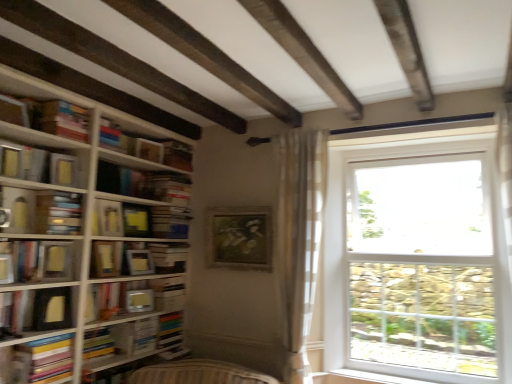
Describe the element at coordinates (298, 239) in the screenshot. The image size is (512, 384). I see `white sheer curtain at center` at that location.

You are a GUI agent. You are given a task and a screenshot of the screen. Output one action in this format:
    pyautogui.click(x=<x>, y=<y>)
    Task: Click on the white sheer curtain at center
    The image size is (512, 384).
    Given the screenshot: What is the action you would take?
    298,239

What do you see at coordinates (144, 183) in the screenshot? I see `hardcover book at center-left, acting as the 2th book starting from the top` at bounding box center [144, 183].

Describe the element at coordinates (240, 238) in the screenshot. I see `wooden picture frame at center` at that location.

What are the coordinates of `yellow matte paper at left, arranged as the fifth paperback book when ordered from the bottom` in the screenshot? It's located at (55, 261).

Describe the element at coordinates (42, 360) in the screenshot. This screenshot has height=384, width=512. I see `hardcover book at left, which ranks as the ninth paperback book in top-to-bottom order` at that location.

You are a GUI agent. You are given a task and a screenshot of the screen. Output one action in this format:
    pyautogui.click(x=<x>, y=<y>)
    Task: Click on the matte yellow paperback at center-left, which appears as the 6th paperback book when viewed from the top
    
    Given the screenshot: What is the action you would take?
    pyautogui.click(x=106, y=259)

This screenshot has height=384, width=512. What are the coordinates of `matte plastic frame at left, arranged as the 2th shelf when viewed from the front` in the screenshot? It's located at (135, 297).

Which is more to the right, matte black book at upper center, which is the 1th paperback book from top to bottom, or white plastic window sill at lower right?

From the viewer's perspective, white plastic window sill at lower right appears more on the right side.

From the image's perspective, who appears lower, matte black book at upper center, acting as the ninth paperback book starting from the bottom, or white plastic window sill at lower right?

From the image's view, white plastic window sill at lower right is below.

From a real-world perspective, is matte black book at upper center, acting as the ninth paperback book starting from the bottom, physically located above or below white plastic window sill at lower right?

matte black book at upper center, acting as the ninth paperback book starting from the bottom, is above white plastic window sill at lower right.

How many degrees apart are the facing directions of matte black book at upper center, which is the 1th paperback book from top to bottom, and white plastic window sill at lower right?

matte black book at upper center, which is the 1th paperback book from top to bottom, and white plastic window sill at lower right are facing 79.8 degrees away from each other.

Is wooden picture frame at center thinner than white plastic window sill at lower right?

Yes, wooden picture frame at center is thinner than white plastic window sill at lower right.

Is white plastic window sill at lower right inside wooden picture frame at center?

That's incorrect, white plastic window sill at lower right is not inside wooden picture frame at center.

Can you confirm if wooden picture frame at center is shorter than white plastic window sill at lower right?

No, wooden picture frame at center is not shorter than white plastic window sill at lower right.

Locate an element on the screen. This screenshot has height=384, width=512. window sill in front of the wooden picture frame at center is located at coordinates (383, 378).

Would you consider matte black book at upper center, acting as the ninth paperback book starting from the bottom, to be distant from white matte paperback book at center, the second paperback book from the bottom?

matte black book at upper center, acting as the ninth paperback book starting from the bottom, is actually quite close to white matte paperback book at center, the second paperback book from the bottom.

Consider the image. Is matte black book at upper center, acting as the ninth paperback book starting from the bottom, looking in the opposite direction of white matte paperback book at center, the eighth paperback book positioned from the top?

matte black book at upper center, acting as the ninth paperback book starting from the bottom, is not turned away from white matte paperback book at center, the eighth paperback book positioned from the top.

How distant is matte black book at upper center, which is the 1th paperback book from top to bottom, from white matte paperback book at center, the second paperback book from the bottom?

89.43 centimeters.

Between matte black book at upper center, which is the 1th paperback book from top to bottom, and white matte paperback book at center, the eighth paperback book positioned from the top, which one is positioned in front?

matte black book at upper center, which is the 1th paperback book from top to bottom.

Is matte yellow paperback at center-left, which appears as the 6th paperback book when viewed from the top, taller or shorter than matte brown book at left, the 7th paperback book in the bottom-to-top sequence?

In the image, matte yellow paperback at center-left, which appears as the 6th paperback book when viewed from the top, appears to be taller than matte brown book at left, the 7th paperback book in the bottom-to-top sequence.

Looking at this image, considering the positions of objects matte yellow paperback at center-left, which appears as the 6th paperback book when viewed from the top, and matte brown book at left, arranged as the third paperback book when viewed from the top, in the image provided, who is more to the left, matte yellow paperback at center-left, which appears as the 6th paperback book when viewed from the top, or matte brown book at left, arranged as the third paperback book when viewed from the top,?

matte brown book at left, arranged as the third paperback book when viewed from the top, is more to the left.

Consider the image. Considering their positions, is matte yellow paperback at center-left, which appears as the 6th paperback book when viewed from the top, located in front of or behind matte brown book at left, the 7th paperback book in the bottom-to-top sequence?

matte yellow paperback at center-left, which appears as the 6th paperback book when viewed from the top, is positioned farther from the viewer than matte brown book at left, the 7th paperback book in the bottom-to-top sequence.

Considering the relative sizes of matte yellow paperback at center-left, marked as the fourth paperback book in a bottom-to-top arrangement, and matte brown book at left, arranged as the third paperback book when viewed from the top, in the image provided, is matte yellow paperback at center-left, marked as the fourth paperback book in a bottom-to-top arrangement, bigger than matte brown book at left, arranged as the third paperback book when viewed from the top,?

Actually, matte yellow paperback at center-left, marked as the fourth paperback book in a bottom-to-top arrangement, might be smaller than matte brown book at left, arranged as the third paperback book when viewed from the top.

Does hardcover book at left, which ranks as the ninth paperback book in top-to-bottom order, turn towards matte plastic frame at left, arranged as the first shelf when viewed from the back?

No, hardcover book at left, which ranks as the ninth paperback book in top-to-bottom order, is not facing towards matte plastic frame at left, arranged as the first shelf when viewed from the back.

Is matte plastic frame at left, arranged as the first shelf when viewed from the back, surrounded by hardcover book at left, marked as the 1th paperback book in a bottom-to-top arrangement?

Actually, matte plastic frame at left, arranged as the first shelf when viewed from the back, is outside hardcover book at left, marked as the 1th paperback book in a bottom-to-top arrangement.

Considering their positions, is hardcover book at left, marked as the 1th paperback book in a bottom-to-top arrangement, located in front of or behind matte plastic frame at left, arranged as the first shelf when viewed from the back?

Visually, hardcover book at left, marked as the 1th paperback book in a bottom-to-top arrangement, is located in front of matte plastic frame at left, arranged as the first shelf when viewed from the back.

Is point (27, 356) more distant than point (111, 307)?

No.

From a real-world perspective, between matte brown book at left, arranged as the third paperback book when viewed from the top, and hardcover book at lower left, the first book positioned from the bottom, who is vertically higher?

In real-world perspective, matte brown book at left, arranged as the third paperback book when viewed from the top, is above.

Between matte brown book at left, arranged as the third paperback book when viewed from the top, and hardcover book at lower left, the first book positioned from the bottom, which one has smaller width?

matte brown book at left, arranged as the third paperback book when viewed from the top, is thinner.

Is matte brown book at left, the 7th paperback book in the bottom-to-top sequence, closer to the viewer compared to hardcover book at lower left, the first book positioned from the bottom?

That is True.

Which is closer to the camera, (457,377) or (144,159)?

Point (457,377) is closer to the camera than point (144,159).

Would you say matte black book at upper center, which is the 1th paperback book from top to bottom, is part of white plastic window sill at lower right's contents?

That's incorrect, matte black book at upper center, which is the 1th paperback book from top to bottom, is not inside white plastic window sill at lower right.

Is the depth of white plastic window sill at lower right greater than that of matte black book at upper center, acting as the ninth paperback book starting from the bottom?

No, white plastic window sill at lower right is closer to the viewer.

I want to click on window sill below the matte black book at upper center, acting as the ninth paperback book starting from the bottom (from the image's perspective), so 383,378.

Where is `window sill on the right of wooden picture frame at center`? This screenshot has width=512, height=384. window sill on the right of wooden picture frame at center is located at coordinates (383, 378).

Estimate the real-world distances between objects in this image. Which object is further from yellow matte paper at center, positioned as the fourth paperback book in top-to-bottom order, yellow matte paper at left, the 5th paperback book from the top, or hardcover book at lower left, the first book positioned from the bottom?

hardcover book at lower left, the first book positioned from the bottom, lies further to yellow matte paper at center, positioned as the fourth paperback book in top-to-bottom order, than the other object.

Based on their spatial positions, is white matte paperback book at center, the eighth paperback book positioned from the top, or matte black frame at lower left, acting as the 2th shelf starting from the back, further from matte yellow paperback at left, which is the seventh paperback book in top-to-bottom order?

white matte paperback book at center, the eighth paperback book positioned from the top, is further to matte yellow paperback at left, which is the seventh paperback book in top-to-bottom order.

Based on their spatial positions, is matte yellow paperback at center-left, marked as the fourth paperback book in a bottom-to-top arrangement, or yellow matte paper at upper left, which appears as the second paperback book when viewed from the top, further from matte yellow book at left, which is the 4th book in bottom-to-top order?

matte yellow paperback at center-left, marked as the fourth paperback book in a bottom-to-top arrangement, is positioned further to the anchor matte yellow book at left, which is the 4th book in bottom-to-top order.

When comparing their distances from white cardboard book at center, the 3th book when ordered from top to bottom, does matte black frame at lower left, which is counted as the second shelf, starting from the right, or matte yellow paperback at left, marked as the 3th paperback book in a bottom-to-top arrangement, seem further?

Among the two, matte black frame at lower left, which is counted as the second shelf, starting from the right, is located further to white cardboard book at center, the 3th book when ordered from top to bottom.

Considering their positions, is hardcover book at left, marked as the 1th paperback book in a bottom-to-top arrangement, positioned closer to matte black book at upper center, which is the 1th paperback book from top to bottom, than white sheer curtain at center?

The object closer to matte black book at upper center, which is the 1th paperback book from top to bottom, is white sheer curtain at center.

Considering their positions, is matte yellow book at left, which is the 4th book in bottom-to-top order, positioned further to hardcover book at center-left, which is counted as the third book, starting from the bottom, than matte black frame at lower left, which is counted as the second shelf, starting from the right?

Based on the image, matte black frame at lower left, which is counted as the second shelf, starting from the right, appears to be further to hardcover book at center-left, which is counted as the third book, starting from the bottom.

Looking at the image, which one is located closer to white cardboard book at center, which is the second book from bottom to top, wooden picture frame at center or clear glass window at right?

Among the two, wooden picture frame at center is located nearer to white cardboard book at center, which is the second book from bottom to top.

Looking at the image, which one is located closer to white plastic window sill at lower right, yellow matte paper at left, the 5th paperback book from the top, or hardcover book at center-left, which is counted as the third book, starting from the bottom?

Among the two, hardcover book at center-left, which is counted as the third book, starting from the bottom, is located nearer to white plastic window sill at lower right.

Where is `picture frame situated between yellow matte paper at upper left, which appears as the second paperback book when viewed from the top, and white plastic window sill at lower right from left to right`? picture frame situated between yellow matte paper at upper left, which appears as the second paperback book when viewed from the top, and white plastic window sill at lower right from left to right is located at coordinates (240, 238).

This screenshot has height=384, width=512. What are the coordinates of `shelf between matte yellow paperback at left, marked as the 3th paperback book in a bottom-to-top arrangement, and white matte paperback book at center, the second paperback book from the bottom, along the z-axis` in the screenshot? It's located at (135, 297).

This screenshot has width=512, height=384. I want to click on window sill between white matte paperback book at center, the second paperback book from the bottom, and clear glass window at right, so click(383, 378).

At what (x,y) coordinates should I click in order to perform the action: click on window between white sheer curtain at center and white plastic window sill at lower right in the up-down direction. Please return your answer as a coordinate pair (x, y). Looking at the image, I should click on pos(416,257).